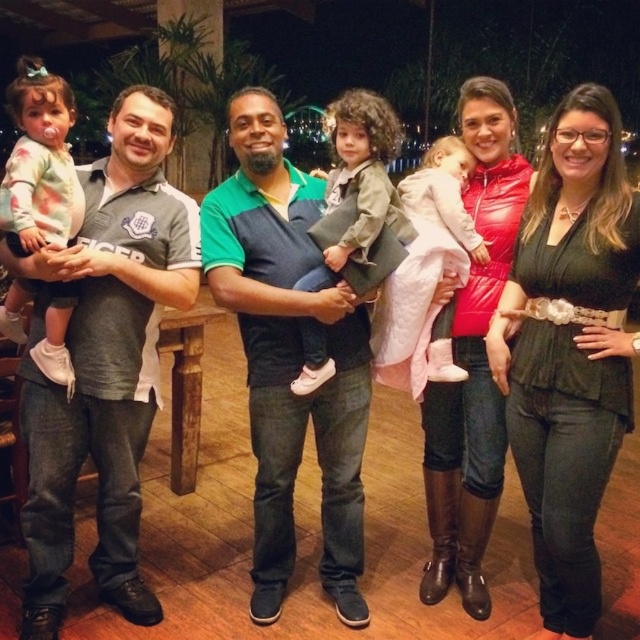
What do you see at coordinates (472, 360) in the screenshot?
I see `matte red jacket at center` at bounding box center [472, 360].

Between matte red jacket at center and matte green jacket at center, which one is positioned lower?

matte red jacket at center is below.

The height and width of the screenshot is (640, 640). What are the coordinates of `matte red jacket at center` in the screenshot? It's located at (472, 360).

Does floral-patterned sweater at left come in front of matte green jacket at center?

Yes, floral-patterned sweater at left is in front of matte green jacket at center.

In the scene shown: Does floral-patterned sweater at left have a larger size compared to matte green jacket at center?

Yes.

Find the location of a particular element. This screenshot has width=640, height=640. floral-patterned sweater at left is located at coordinates (40, 161).

I want to click on green fabric shirt at center, so click(289, 356).

Does green fabric shirt at center have a lesser width compared to quilted pink jacket at center?

In fact, green fabric shirt at center might be wider than quilted pink jacket at center.

What do you see at coordinates (289, 356) in the screenshot? I see `green fabric shirt at center` at bounding box center [289, 356].

The width and height of the screenshot is (640, 640). In order to click on green fabric shirt at center in this screenshot , I will do `click(289, 356)`.